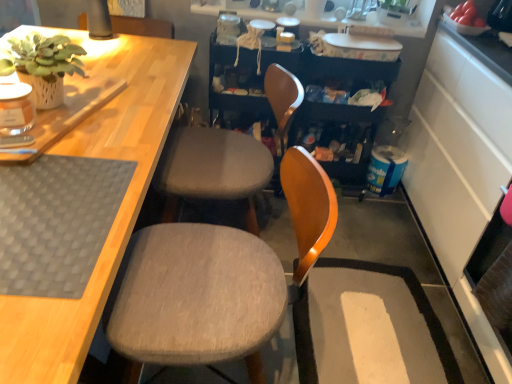
Question: Is gray fabric chair at center, the first chair in the front-to-back sequence, oriented towards white glossy shelves at upper center?

Choices:
 (A) no
 (B) yes

Answer: (A)

Question: Is there a large distance between gray fabric chair at center, which ranks as the 2th chair in back-to-front order, and white glossy shelves at upper center?

Choices:
 (A) yes
 (B) no

Answer: (A)

Question: From the image's perspective, is gray fabric chair at center, the first chair in the front-to-back sequence, under white glossy shelves at upper center?

Choices:
 (A) no
 (B) yes

Answer: (B)

Question: Is gray fabric chair at center, the first chair in the front-to-back sequence, positioned behind white glossy shelves at upper center?

Choices:
 (A) no
 (B) yes

Answer: (A)

Question: Is gray fabric chair at center, the first chair in the front-to-back sequence, taller than white glossy shelves at upper center?

Choices:
 (A) no
 (B) yes

Answer: (B)

Question: From a real-world perspective, is gray fabric chair at center, which ranks as the 2th chair in back-to-front order, under white glossy shelves at upper center?

Choices:
 (A) no
 (B) yes

Answer: (B)

Question: Could you tell me if gray fabric chair at center, which ranks as the 2th chair in back-to-front order, is turned towards textured gray cushion at center, the 2th chair positioned from the front?

Choices:
 (A) yes
 (B) no

Answer: (B)

Question: Does gray fabric chair at center, the first chair in the front-to-back sequence, have a greater height compared to textured gray cushion at center, the 2th chair positioned from the front?

Choices:
 (A) yes
 (B) no

Answer: (B)

Question: Is gray fabric chair at center, which ranks as the 2th chair in back-to-front order, shorter than textured gray cushion at center, the 2th chair positioned from the front?

Choices:
 (A) yes
 (B) no

Answer: (A)

Question: Is gray fabric chair at center, which ranks as the 2th chair in back-to-front order, smaller than textured gray cushion at center, the first chair when ordered from back to front?

Choices:
 (A) no
 (B) yes

Answer: (A)

Question: Does gray fabric chair at center, which ranks as the 2th chair in back-to-front order, have a greater width compared to textured gray cushion at center, the 2th chair positioned from the front?

Choices:
 (A) no
 (B) yes

Answer: (B)

Question: Does gray fabric chair at center, which ranks as the 2th chair in back-to-front order, have a larger size compared to textured gray cushion at center, the first chair when ordered from back to front?

Choices:
 (A) yes
 (B) no

Answer: (A)

Question: Are green matte plant at upper left and white glossy shelves at upper center beside each other?

Choices:
 (A) yes
 (B) no

Answer: (B)